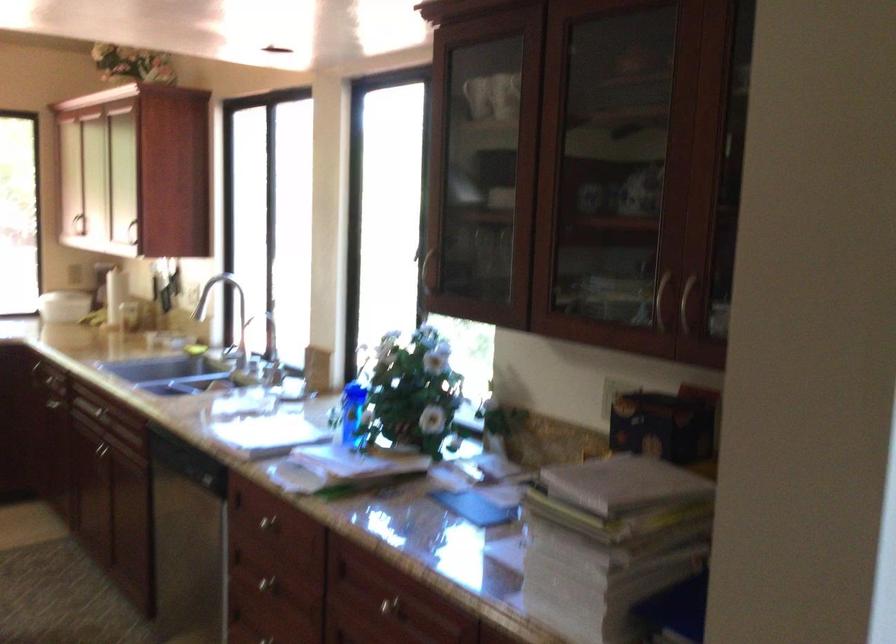
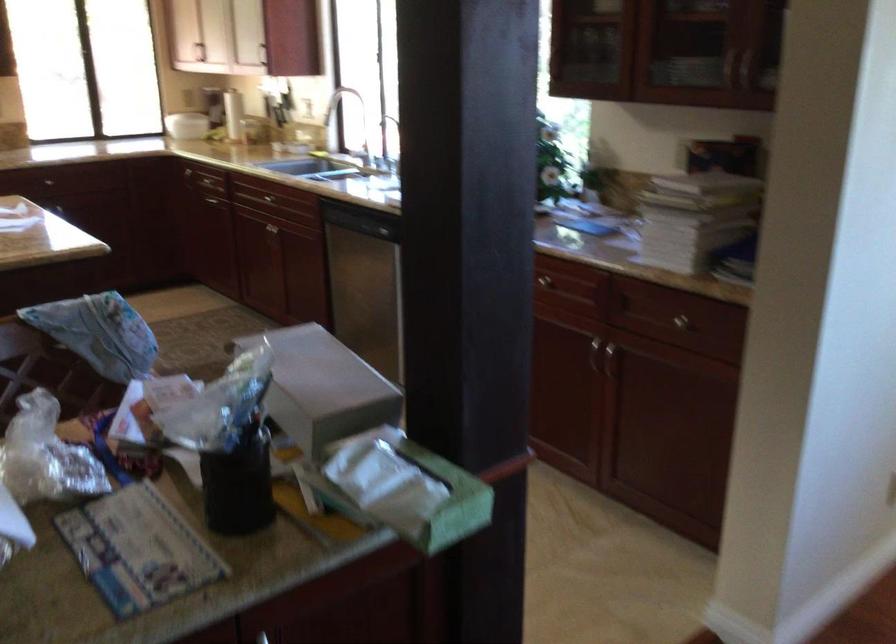
Question: I am providing you with two images of the same scene from different viewpoints. Please identify which objects are invisible in image2.

Choices:
 (A) faucet handle
 (B) metal cabinet handle
 (C) metal pencil holder
 (D) silver drawer knob

Answer: (D)